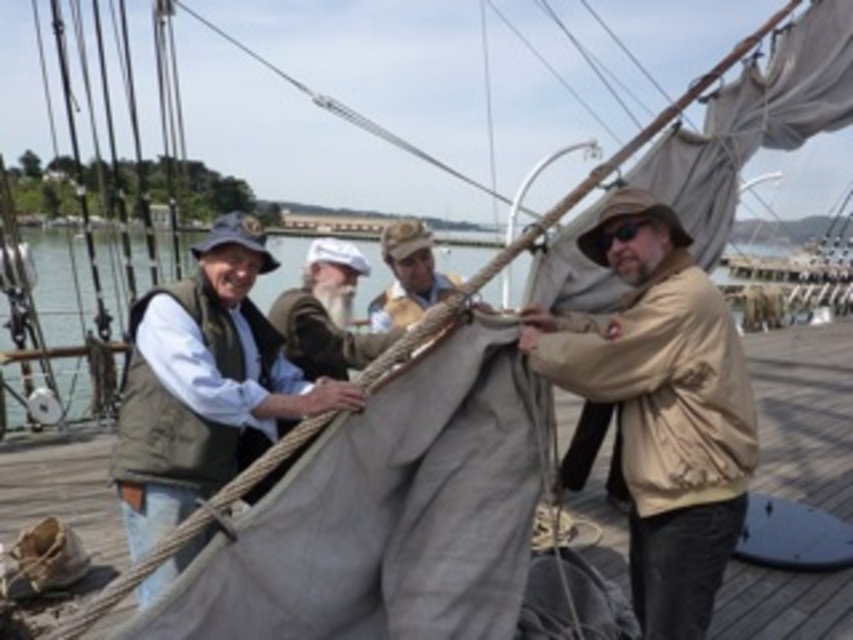
Can you confirm if green canvas vest at left is positioned above khaki fabric hat at center?

Actually, green canvas vest at left is below khaki fabric hat at center.

Does point (258, 244) come closer to viewer compared to point (398, 282)?

Yes.

You are a GUI agent. You are given a task and a screenshot of the screen. Output one action in this format:
    pyautogui.click(x=<x>, y=<y>)
    Task: Click on the green canvas vest at left
    The image size is (853, 640).
    Given the screenshot: What is the action you would take?
    pyautogui.click(x=204, y=384)

Does tan matte jacket at center appear under matte gray sail at center?

Indeed, tan matte jacket at center is positioned under matte gray sail at center.

Is point (612, 380) positioned after point (102, 253)?

No, it is in front of (102, 253).

Locate an element on the screen. The height and width of the screenshot is (640, 853). tan matte jacket at center is located at coordinates (x=662, y=406).

Image resolution: width=853 pixels, height=640 pixels. What are the coordinates of `tan matte jacket at center` in the screenshot? It's located at (662, 406).

Consider the image. Is tan matte jacket at center to the left of green canvas vest at left from the viewer's perspective?

No, tan matte jacket at center is not to the left of green canvas vest at left.

From the picture: Between tan matte jacket at center and green canvas vest at left, which one has more height?

Standing taller between the two is tan matte jacket at center.

At what (x,y) coordinates should I click in order to perform the action: click on tan matte jacket at center. Please return your answer as a coordinate pair (x, y). Image resolution: width=853 pixels, height=640 pixels. Looking at the image, I should click on (662, 406).